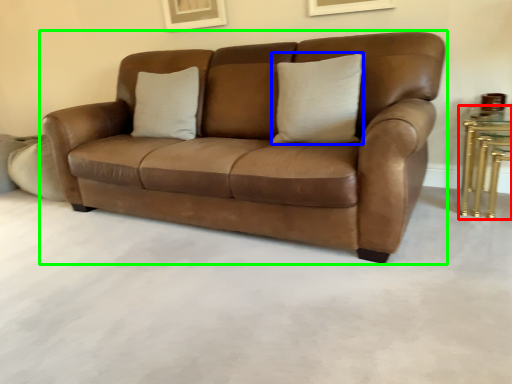
Question: Based on their relative distances, which object is farther from table (highlighted by a red box)? Choose from pillow (highlighted by a blue box) and studio couch (highlighted by a green box).

Choices:
 (A) pillow
 (B) studio couch

Answer: (B)